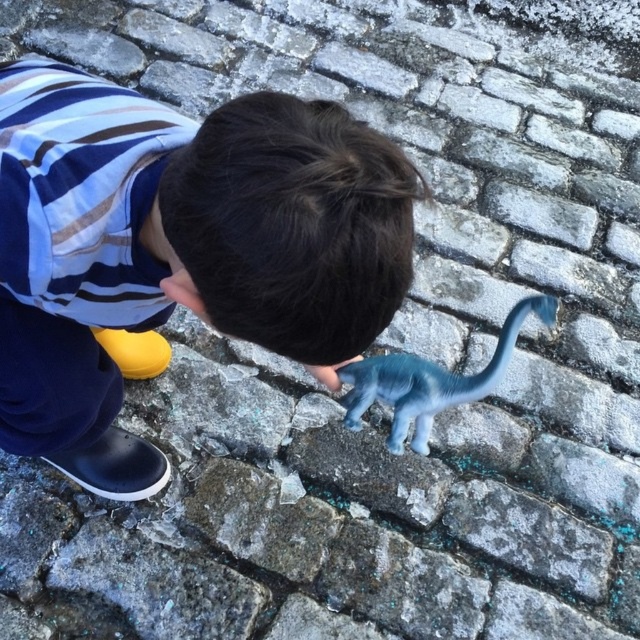
Question: Which of the following is the closest to the observer?

Choices:
 (A) blue rubber dinosaur at center
 (B) blue rubber boots at lower left

Answer: (B)

Question: Can you confirm if blue rubber boots at lower left is wider than blue rubber dinosaur at center?

Choices:
 (A) no
 (B) yes

Answer: (B)

Question: Can you confirm if blue rubber boots at lower left is positioned to the left of blue rubber dinosaur at center?

Choices:
 (A) no
 (B) yes

Answer: (B)

Question: Does blue rubber boots at lower left have a smaller size compared to blue rubber dinosaur at center?

Choices:
 (A) yes
 (B) no

Answer: (B)

Question: Which of the following is the closest to the observer?

Choices:
 (A) (435, 384)
 (B) (387, 160)

Answer: (B)